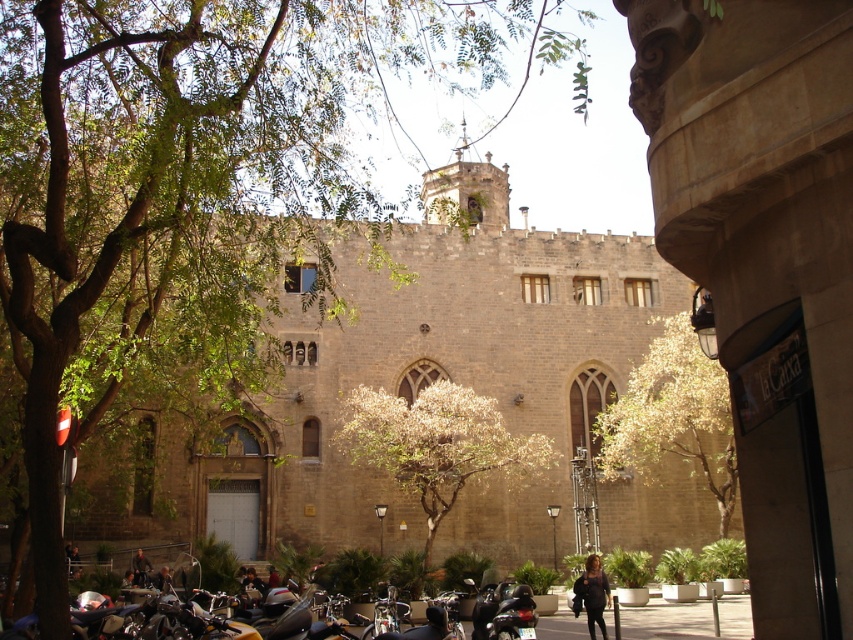
You are a visitor to this historic area and want to park your car under the green leafy tree at upper left. However, there is a shiny black motorcycle at lower center in the way. Can you park your car there without moving the motorcycle?

The green leafy tree at upper left is positioned over the shiny black motorcycle at lower center, meaning the motorcycle is directly beneath the tree. Since the motorcycle is already occupying the space under the tree, you cannot park your car there without moving the motorcycle.

You are a photographer planning to take a picture of the historic stone building. You want to ensure both the green leafy tree at upper left and the shiny black motorcycle at lower center are in the frame. Based on their sizes, which object should you focus on to include both in the composition?

The green leafy tree at upper left might be wider than the shiny black motorcycle at lower center, so focusing on the wider tree would help ensure both are included in the frame.